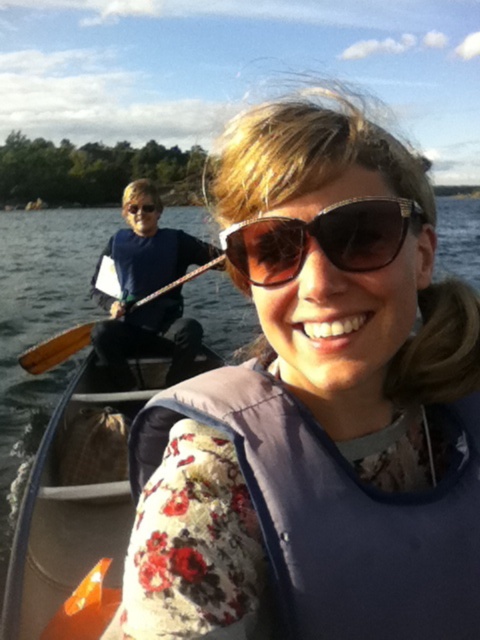
Question: Which object is closer to the camera taking this photo?

Choices:
 (A) brown wooden paddle at left
 (B) sunglasses at center
 (C) matte blue life vest at center

Answer: (B)

Question: Does blue fabric shirt at left come behind sunglasses at center?

Choices:
 (A) no
 (B) yes

Answer: (B)

Question: Does matte blue life vest at center appear under sunglasses at center?

Choices:
 (A) no
 (B) yes

Answer: (B)

Question: Considering the real-world distances, which object is closest to the matte blue life vest at center?

Choices:
 (A) blue fabric shirt at left
 (B) sunglasses at center
 (C) brown wooden paddle at left

Answer: (B)

Question: Which point is closer to the camera?

Choices:
 (A) blue fabric shirt at left
 (B) matte blue life vest at center
 (C) brown wooden paddle at left
 (D) sunglasses at center

Answer: (D)

Question: In this image, where is sunglasses at center located relative to brown wooden paddle at left?

Choices:
 (A) above
 (B) below

Answer: (A)